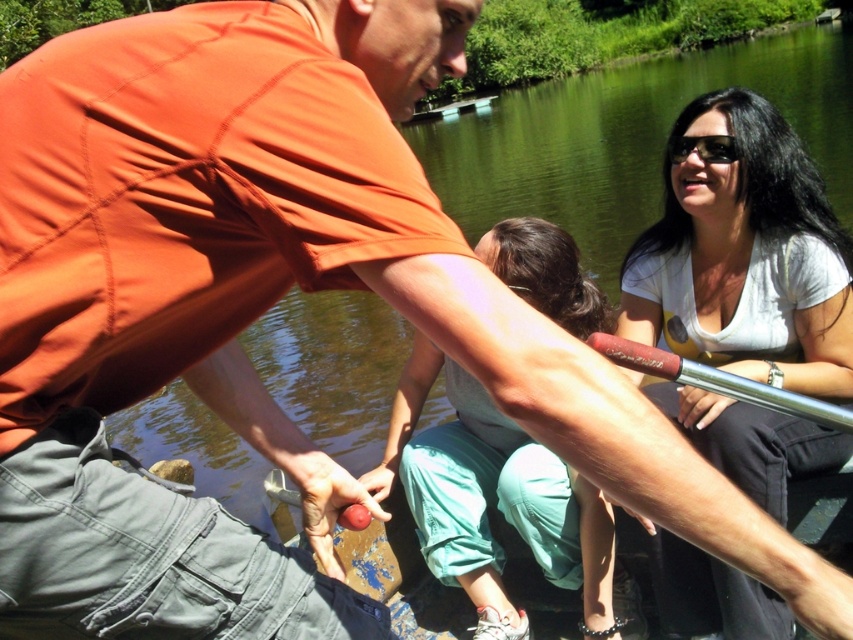
Does white matte shirt at upper right have a larger size compared to rubberized red paddle at center?

Yes.

You are a GUI agent. You are given a task and a screenshot of the screen. Output one action in this format:
    pyautogui.click(x=<x>, y=<y>)
    Task: Click on the white matte shirt at upper right
    This screenshot has width=853, height=640.
    Given the screenshot: What is the action you would take?
    pyautogui.click(x=744, y=253)

Locate an element on the screen. white matte shirt at upper right is located at coordinates (744, 253).